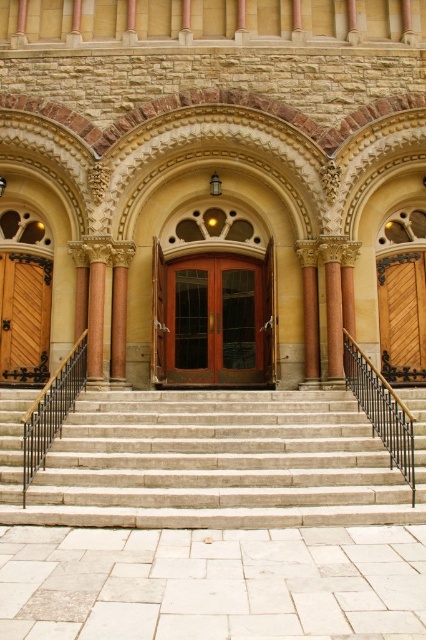
You are standing at the entrance of the grand building and want to approach the polished bronze column at center. Which direction should you move relative to the gray stone stairs at center?

To reach the polished bronze column at center, you should move behind the gray stone stairs at center since the stairs are in front of the column.

You are a visitor approaching the entrance of the grand building. You see the wooden door at right and the black wrought iron railing at center. Which object is closer to you as you approach the entrance?

The wooden door at right is closer to you because the black wrought iron railing at center is behind it.